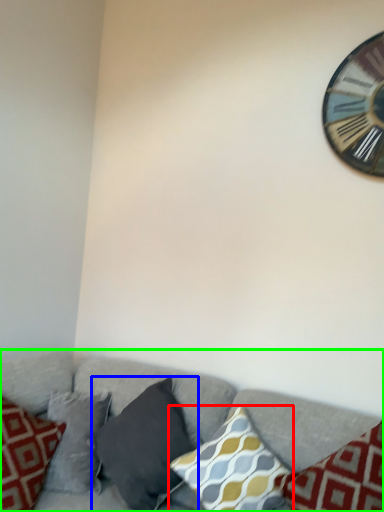
Question: Which object is the farthest from pillow (highlighted by a red box)? Choose among these: pillow (highlighted by a blue box) or studio couch (highlighted by a green box).

Choices:
 (A) pillow
 (B) studio couch

Answer: (B)